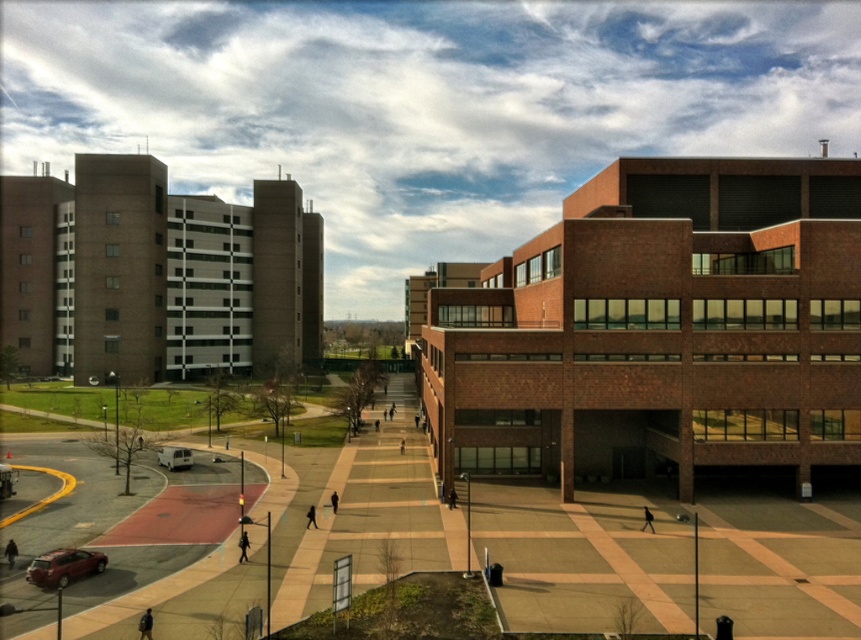
Question: Does metallic red car at bottom left have a larger size compared to white matte van at lower left?

Choices:
 (A) no
 (B) yes

Answer: (A)

Question: Can you confirm if brick building at center is thinner than white matte van at lower left?

Choices:
 (A) yes
 (B) no

Answer: (B)

Question: Is metallic red car at bottom left above white matte van at lower left?

Choices:
 (A) yes
 (B) no

Answer: (B)

Question: Based on their relative distances, which object is nearer to the white matte van at lower left?

Choices:
 (A) brick building at center
 (B) metallic red car at bottom left

Answer: (B)

Question: Among these points, which one is nearest to the camera?

Choices:
 (A) (91, 552)
 (B) (760, 276)

Answer: (A)

Question: Which object appears closest to the camera in this image?

Choices:
 (A) white matte van at lower left
 (B) brick building at center

Answer: (B)